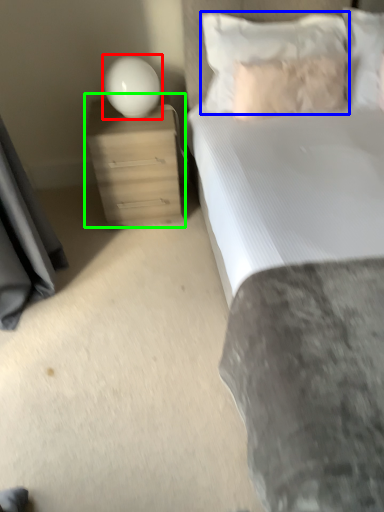
Question: Estimate the real-world distances between objects in this image. Which object is closer to lamp (highlighted by a red box), pillow (highlighted by a blue box) or nightstand (highlighted by a green box)?

Choices:
 (A) pillow
 (B) nightstand

Answer: (B)